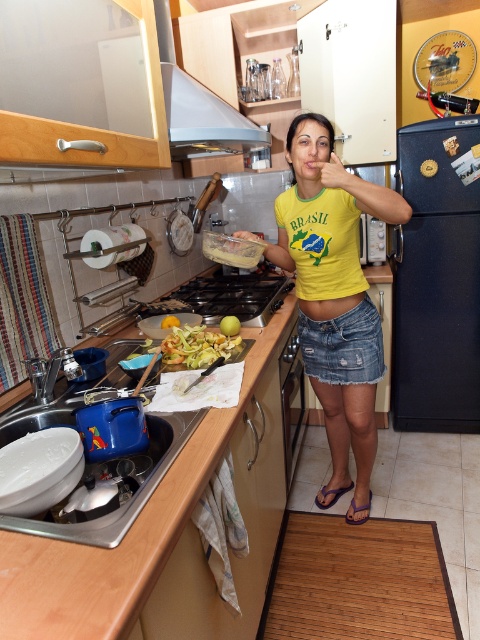
You are a chef standing in the kitchen and need to locate the silver metallic exhaust hood at upper center. What are the coordinates of its position?

The silver metallic exhaust hood at upper center is located at point coordinates [199,108].

You are a chef standing in the kitchen and need to reach the silver metallic exhaust hood at upper center to adjust the fan speed. Your arm can extend 1.5 meters. Can you reach it?

The silver metallic exhaust hood at upper center is 1.67 meters away from the viewer, so you cannot reach it with an arm extension of 1.5 meters.